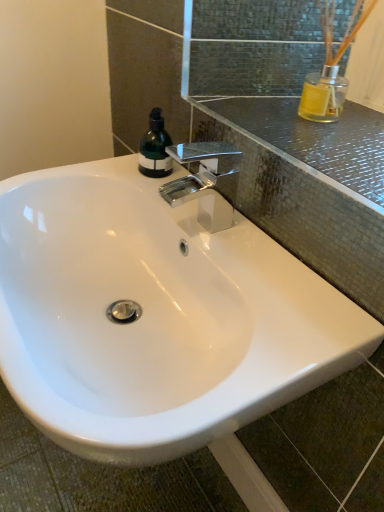
Question: Is white glossy sink at center surrounded by polished chrome faucet at upper center?

Choices:
 (A) no
 (B) yes

Answer: (A)

Question: Does polished chrome faucet at upper center have a greater height compared to white glossy sink at center?

Choices:
 (A) yes
 (B) no

Answer: (B)

Question: Considering the relative sizes of polished chrome faucet at upper center and white glossy sink at center in the image provided, is polished chrome faucet at upper center thinner than white glossy sink at center?

Choices:
 (A) no
 (B) yes

Answer: (B)

Question: Is polished chrome faucet at upper center positioned in front of white glossy sink at center?

Choices:
 (A) no
 (B) yes

Answer: (A)

Question: Can you see polished chrome faucet at upper center touching white glossy sink at center?

Choices:
 (A) yes
 (B) no

Answer: (B)

Question: From a real-world perspective, is polished chrome faucet at upper center physically located above or below white glossy sink at center?

Choices:
 (A) below
 (B) above

Answer: (B)

Question: Is point (236, 172) closer or farther from the camera than point (39, 173)?

Choices:
 (A) farther
 (B) closer

Answer: (B)

Question: In terms of height, does polished chrome faucet at upper center look taller or shorter compared to white glossy sink at center?

Choices:
 (A) short
 (B) tall

Answer: (A)

Question: Considering the positions of polished chrome faucet at upper center and white glossy sink at center in the image, is polished chrome faucet at upper center wider or thinner than white glossy sink at center?

Choices:
 (A) thin
 (B) wide

Answer: (A)

Question: Is green matte bottle at upper left wider or thinner than polished chrome faucet at upper center?

Choices:
 (A) wide
 (B) thin

Answer: (B)

Question: Is green matte bottle at upper left spatially inside polished chrome faucet at upper center, or outside of it?

Choices:
 (A) outside
 (B) inside

Answer: (A)

Question: From the image's perspective, is green matte bottle at upper left positioned above or below polished chrome faucet at upper center?

Choices:
 (A) below
 (B) above

Answer: (B)

Question: In terms of size, does green matte bottle at upper left appear bigger or smaller than polished chrome faucet at upper center?

Choices:
 (A) small
 (B) big

Answer: (A)

Question: Is white glossy sink at center spatially inside green matte bottle at upper left, or outside of it?

Choices:
 (A) outside
 (B) inside

Answer: (A)

Question: In terms of width, does white glossy sink at center look wider or thinner when compared to green matte bottle at upper left?

Choices:
 (A) thin
 (B) wide

Answer: (B)